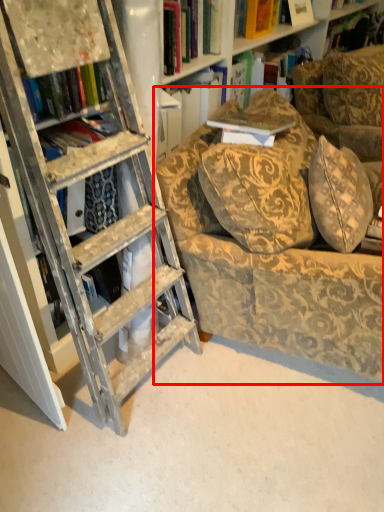
Question: From the image's perspective, where is chair (annotated by the red box) located relative to book?

Choices:
 (A) above
 (B) below

Answer: (B)